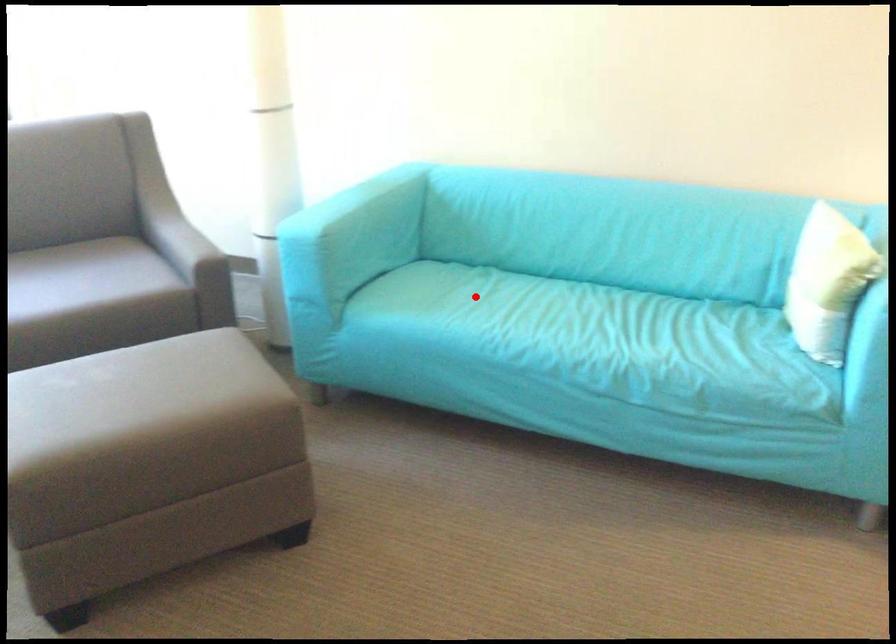
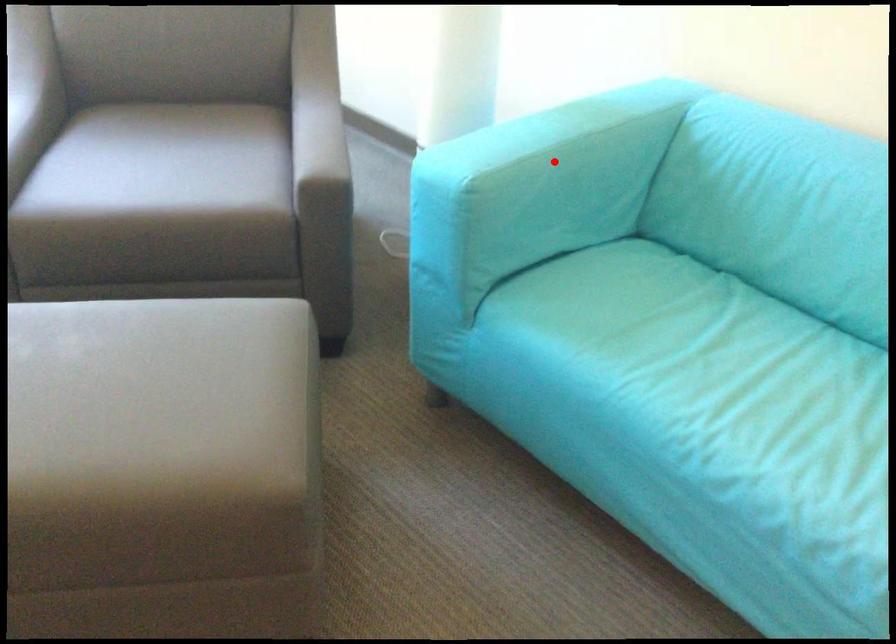
I am providing you with two images of the same scene from different viewpoints. A red point is marked on the first image and another point is marked on the second image. Do the highlighted points in image1 and image2 indicate the same real-world spot?

No